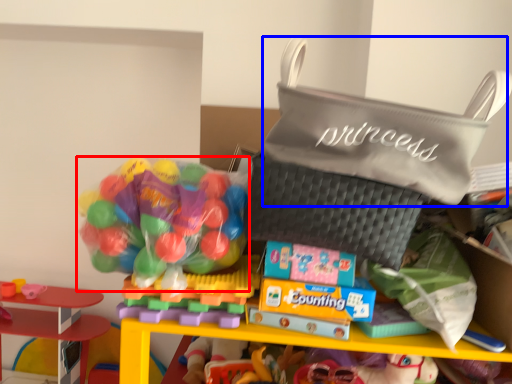
Question: Which object appears farthest to the camera in this image, candy (highlighted by a red box) or pouch (highlighted by a blue box)?

Choices:
 (A) candy
 (B) pouch

Answer: (A)